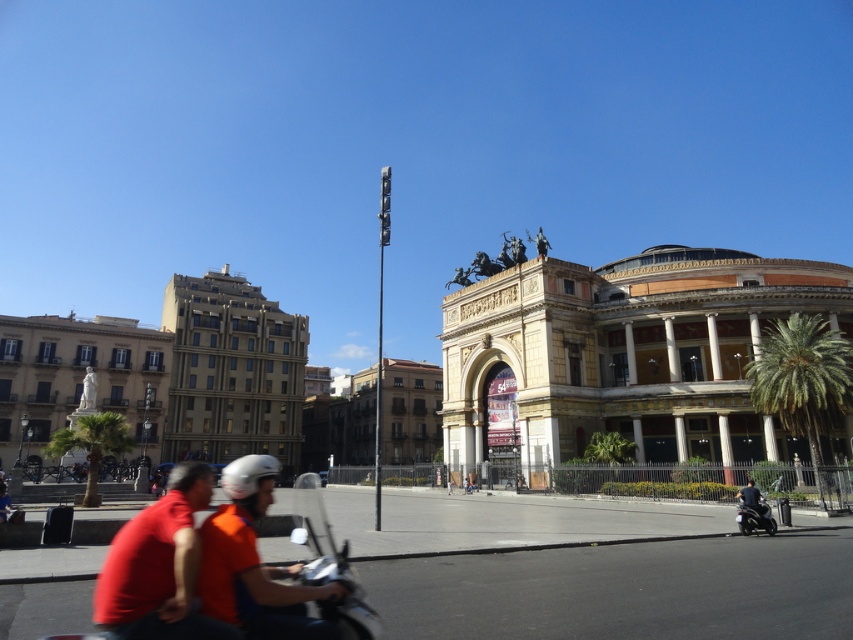
Question: Which object appears farthest from the camera in this image?

Choices:
 (A) orange fabric helmet at center
 (B) red fabric shirt at lower left
 (C) shiny black motorcycle at lower right

Answer: (C)

Question: Can you confirm if green leafy palm tree at lower left is positioned to the left of dark gray fabric jacket at lower right?

Choices:
 (A) yes
 (B) no

Answer: (A)

Question: Does green leafy palm tree at lower left have a smaller size compared to shiny black motorcycle at lower right?

Choices:
 (A) yes
 (B) no

Answer: (B)

Question: Among these objects, which one is farthest from the camera?

Choices:
 (A) red fabric shirt at lower left
 (B) shiny black motorcycle at lower right
 (C) dark gray fabric jacket at lower right

Answer: (C)

Question: Which object is the farthest from the green leafy palm at right?

Choices:
 (A) green leafy palm tree at lower left
 (B) red fabric shirt at lower left
 (C) shiny black motorcycle at lower right
 (D) orange fabric helmet at center

Answer: (A)

Question: Can you confirm if red fabric shirt at lower left is smaller than dark gray fabric jacket at lower right?

Choices:
 (A) yes
 (B) no

Answer: (B)